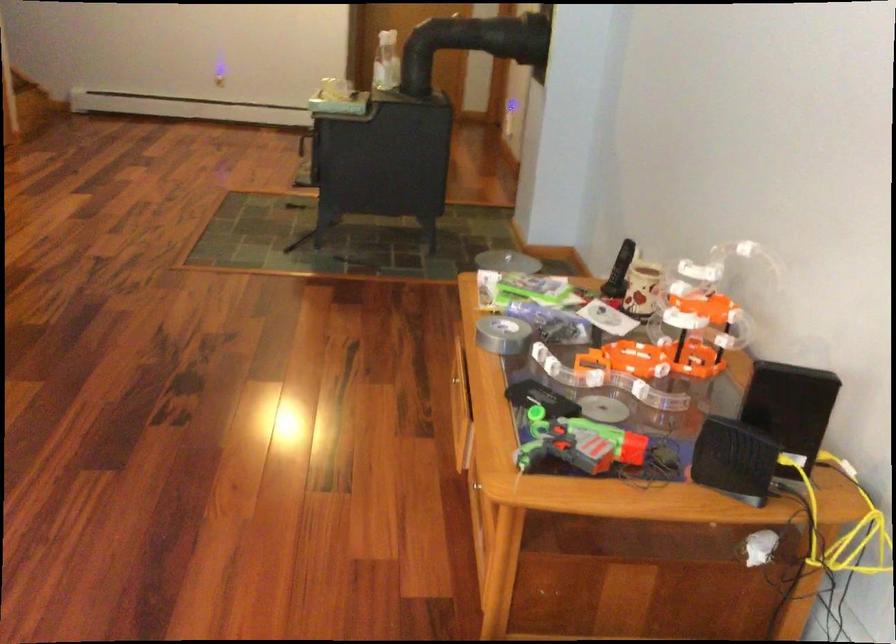
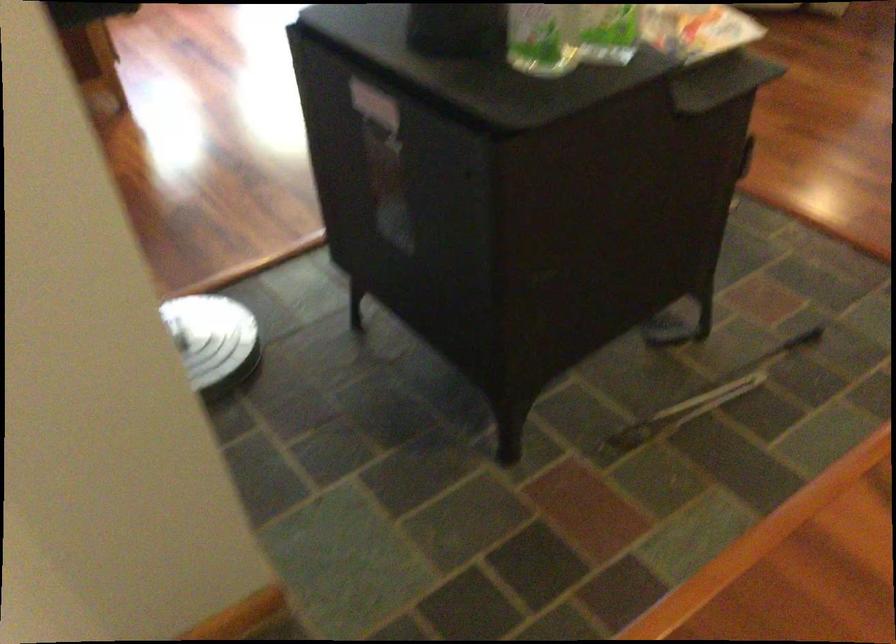
Locate, in the second image, the point that corresponds to pixel 446 113 in the first image.

(375, 104)